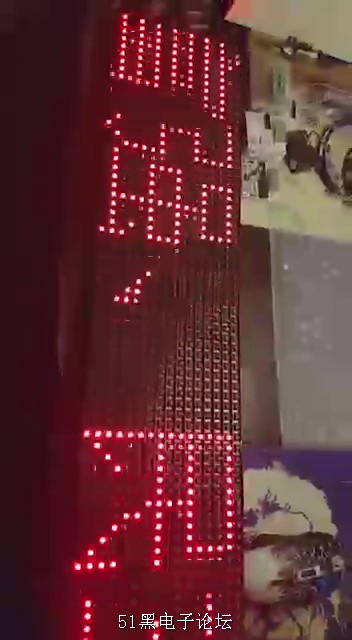
Find the location of a particular element. ceiling is located at coordinates pos(286,16).